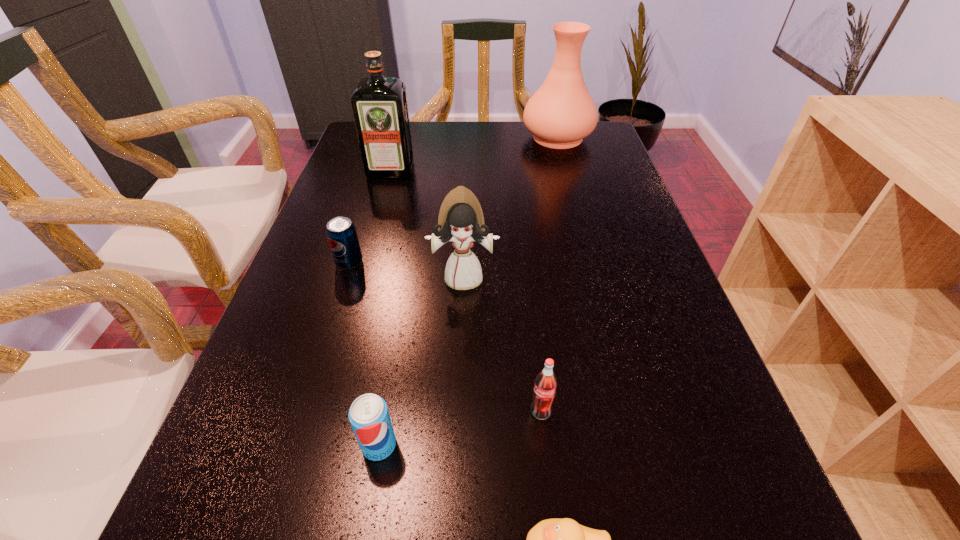
Find the location of `the farthest object`. the farthest object is located at coordinates (561, 113).

Identify the location of liquor. This screenshot has height=540, width=960. (379, 104).

You are a GUI agent. You are given a task and a screenshot of the screen. Output one action in this format:
    pyautogui.click(x=<x>, y=<y>)
    Task: Click on the fourth object from right to left
    
    Given the screenshot: What is the action you would take?
    pyautogui.click(x=461, y=220)

The image size is (960, 540). What are the coordinates of `the third tallest object` in the screenshot? It's located at (461, 220).

Locate an element on the screen. This screenshot has width=960, height=540. the rightmost soda can is located at coordinates [x=544, y=391].

Image resolution: width=960 pixels, height=540 pixels. I want to click on the second nearest soda can, so click(x=544, y=391).

Find the location of a particular element. the second soda can from left to right is located at coordinates (369, 417).

The height and width of the screenshot is (540, 960). Find the location of `the nearest soda can`. the nearest soda can is located at coordinates [x=369, y=417].

Identify the location of the leftmost soda can. The width and height of the screenshot is (960, 540). (341, 233).

Find the location of a particular element. The width and height of the screenshot is (960, 540). vacant space located 0.240m on the front of the farthest object is located at coordinates (575, 200).